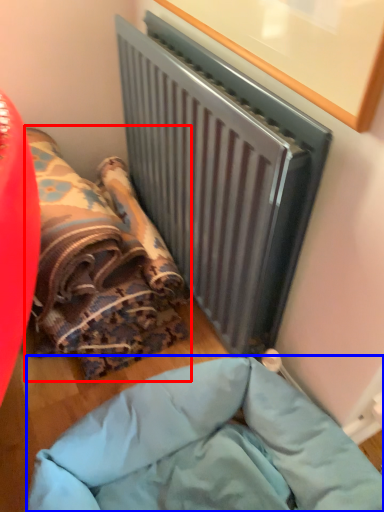
Question: Among these objects, which one is farthest to the camera, bean bag chair (highlighted by a red box) or furniture (highlighted by a blue box)?

Choices:
 (A) bean bag chair
 (B) furniture

Answer: (A)